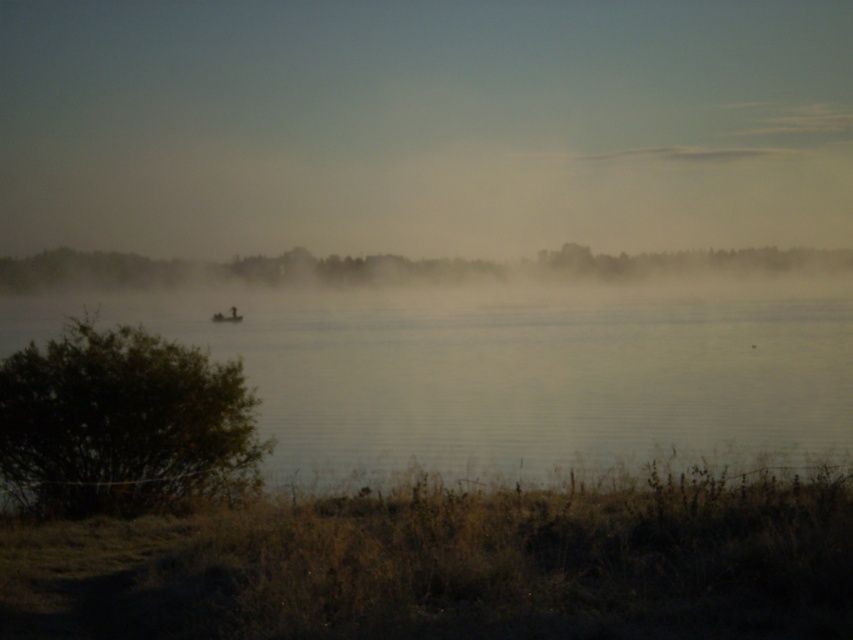
You are a photographer standing at the edge of the water. You want to capture a photo where the clear water at center and the green leafy bush at lower left are both visible. Which object will appear taller in the photo?

The clear water at center will appear taller in the photo because it has a greater height compared to the green leafy bush at lower left.